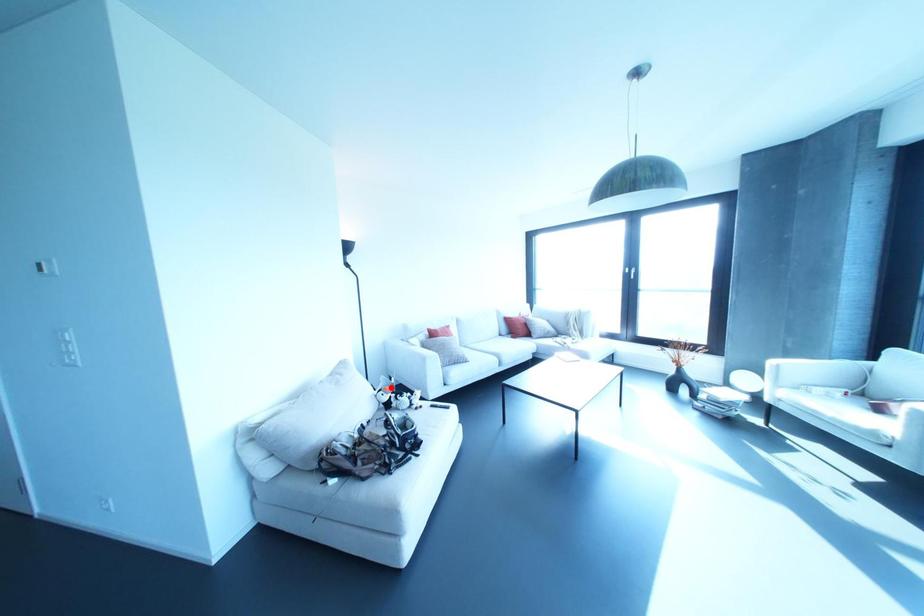
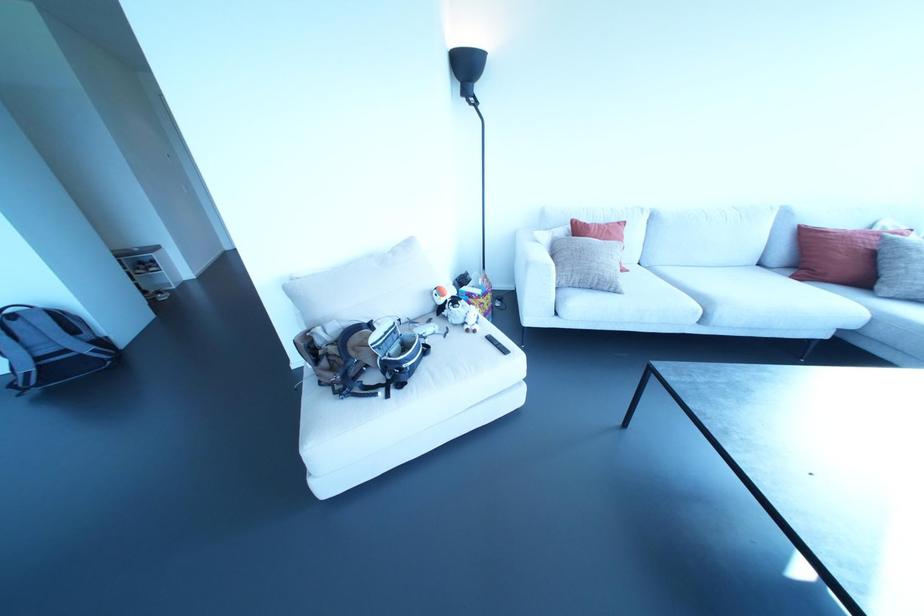
Locate, in the second image, the point that corresponds to the highlighted location in the first image.

(477, 291)